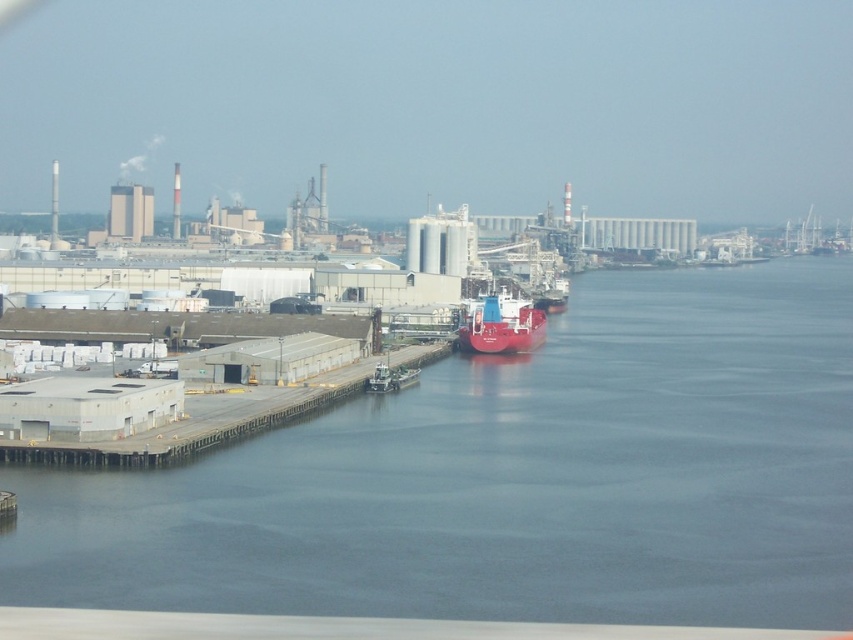
You are a crane operator standing on the gray concrete dock at lower left and need to lower a heavy container onto the red matte ship at center. Considering their heights, will the container be able to reach the ship without hitting the dock?

The gray concrete dock at lower left is taller than the red matte ship at center, so the container might hit the dock when lowering it to the ship. Adjust the crane position or lower the container carefully to avoid collision.

You are standing at the waterfront and want to take a photo of the blue water at center and the gray concrete dock at lower left. Which object will appear larger in your camera view?

The blue water at center will appear larger in the camera view because it is closer to the viewer than the gray concrete dock at lower left.

You are standing on the gray concrete dock at lower left and want to board the red matte ship at center. Based on the scene, is the ship above or below the dock?

The gray concrete dock at lower left is below the red matte ship at center, so the ship is above the dock.